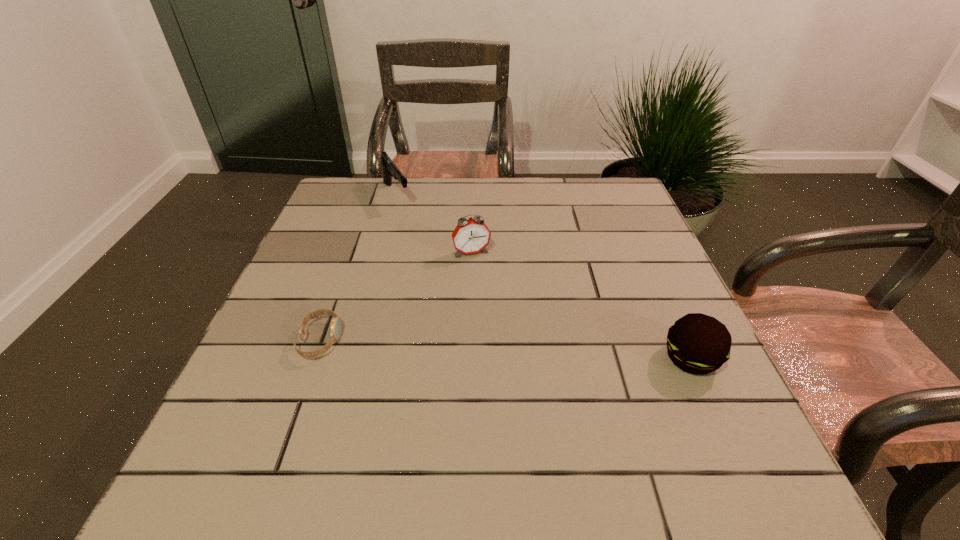
At what (x,y) coordinates should I click in order to perform the action: click on free space on the desktop that is between the watch and the patty and is positioned on the clock face of the second object from right to left. Please return your answer as a coordinate pair (x, y). Looking at the image, I should click on (507, 349).

Identify the location of free spot on the desktop that is between the shortest object and the third tallest object and is positioned at the aiming end of the farthest object. The image size is (960, 540). (507, 349).